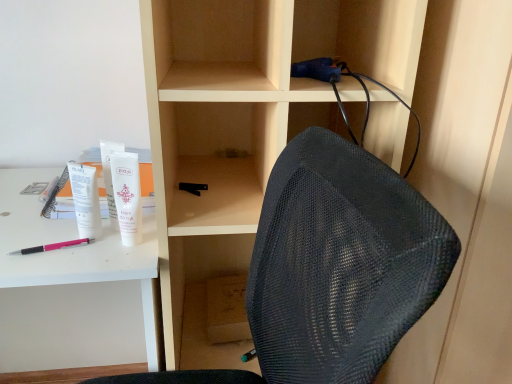
This screenshot has height=384, width=512. Identify the location of free point in front of white matte tube at upper left, the 4th stationery positioned from the right. (67, 260).